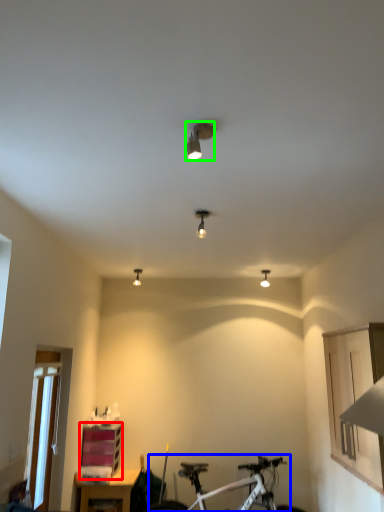
Question: Which object is positioned farthest from shelf (highlighted by a red box)? Select from bicycle (highlighted by a blue box) and light fixture (highlighted by a green box).

Choices:
 (A) bicycle
 (B) light fixture

Answer: (B)